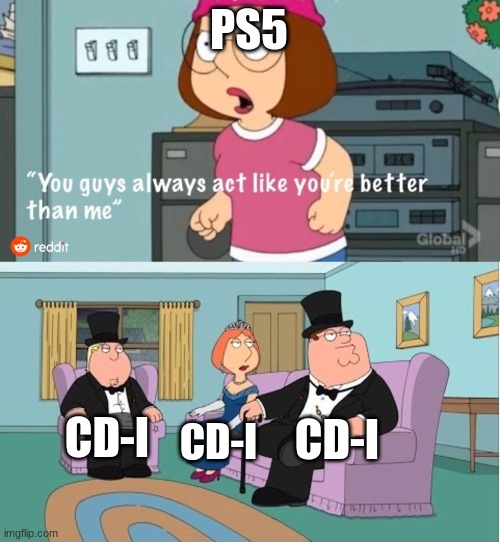
The height and width of the screenshot is (542, 500). Identify the location of green carpet. (359, 522).